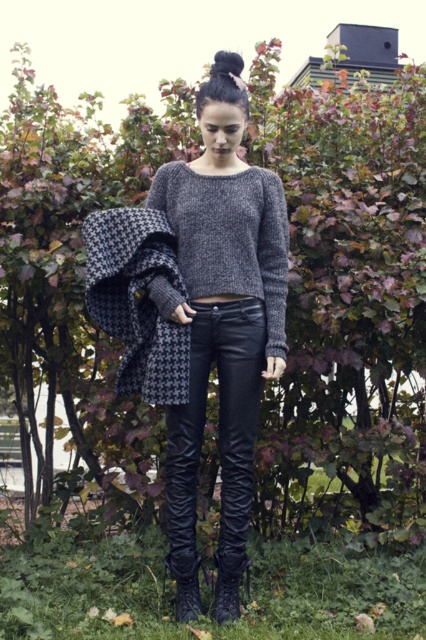
You are a fashion designer observing the person in the image. You notice both the knit sweater at center and the knitted gray sweater at center. Which one is closer to the viewer?

Answer: The knit sweater at center is closer to the viewer as it is in front of the knitted gray sweater at center.

You are a fashion designer trying to create a new outfit. You have a knit sweater at center and a houndstooth wool shawl at left. Which item should you choose if you want to cover more of your upper body?

The knit sweater at center might be wider than houndstooth wool shawl at left, so you should choose the knit sweater at center to cover more of your upper body.

You are a fashion stylist trying to create a layered outfit. You have the knitted gray sweater at center and the houndstooth wool shawl at left. Based on their positions in the image, which item is positioned higher on the person?

The knitted gray sweater at center is positioned higher because it is above the houndstooth wool shawl at left in the image.